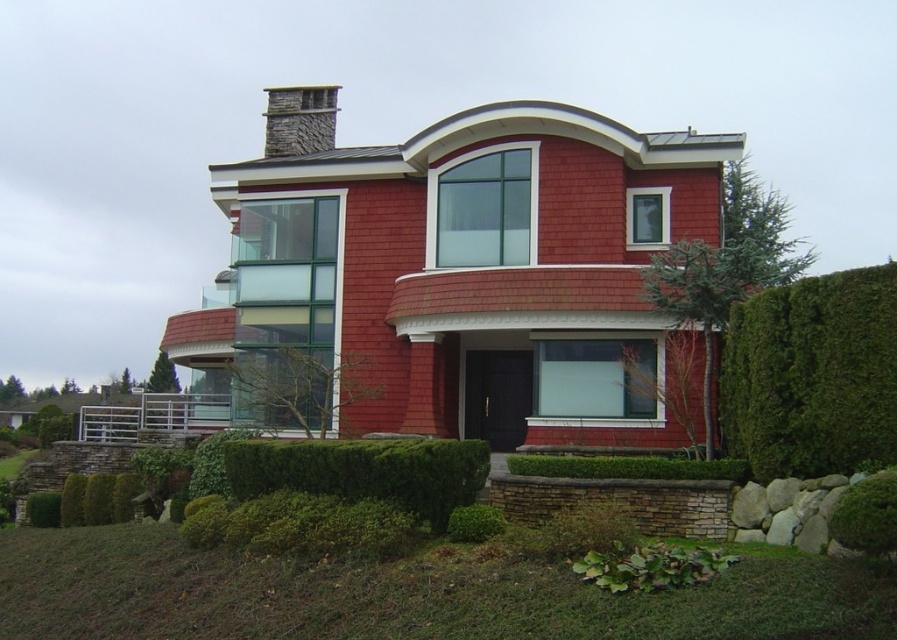
Question: Estimate the real-world distances between objects in this image. Which object is farther from the stone chimney at upper center?

Choices:
 (A) green leafy hedge at lower center
 (B) green leafy hedge at right

Answer: (B)

Question: Which of the following is the farthest from the observer?

Choices:
 (A) (320, 125)
 (B) (460, 488)
 (C) (823, 392)

Answer: (A)

Question: Is green leafy hedge at right thinner than green leafy hedge at lower center?

Choices:
 (A) yes
 (B) no

Answer: (A)

Question: Is green leafy hedge at right below stone chimney at upper center?

Choices:
 (A) no
 (B) yes

Answer: (B)

Question: Among these objects, which one is farthest from the camera?

Choices:
 (A) green leafy hedge at lower center
 (B) green leafy hedge at right
 (C) stone chimney at upper center

Answer: (C)

Question: In this image, where is green leafy hedge at lower center located relative to stone chimney at upper center?

Choices:
 (A) left
 (B) right

Answer: (B)